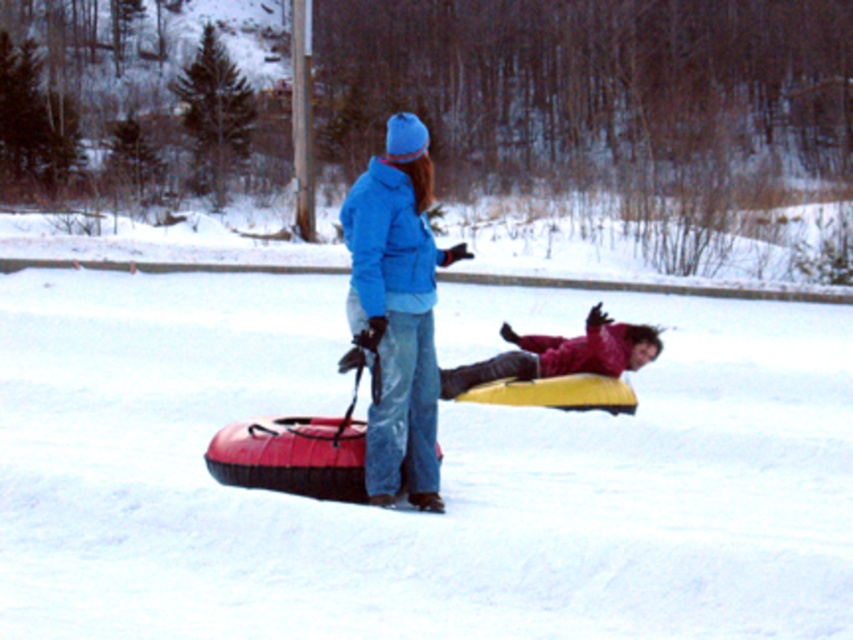
In the scene shown: You are a photographer trying to capture a winter scene. You notice the white matte snow at center and the matte blue jacket at center. Which object occupies more horizontal space in the image?

The white matte snow at center might be wider than matte blue jacket at center according to the description.

You are a photographer trying to capture a photo of both the matte blue jacket at center and the matte yellow tube at lower right in the same frame. Given that your camera has a maximum focus range of 3 meters, will you be able to get both subjects in focus?

The matte blue jacket at center and the matte yellow tube at lower right are 3.24 meters apart from each other. Since the camera can only focus up to 3 meters, the distance between them exceeds the focus range. Therefore, both subjects cannot be in focus simultaneously.

Looking at this image, where is the white matte snow at center located in the image?

The white matte snow at center is located at point coordinates of (440, 472).